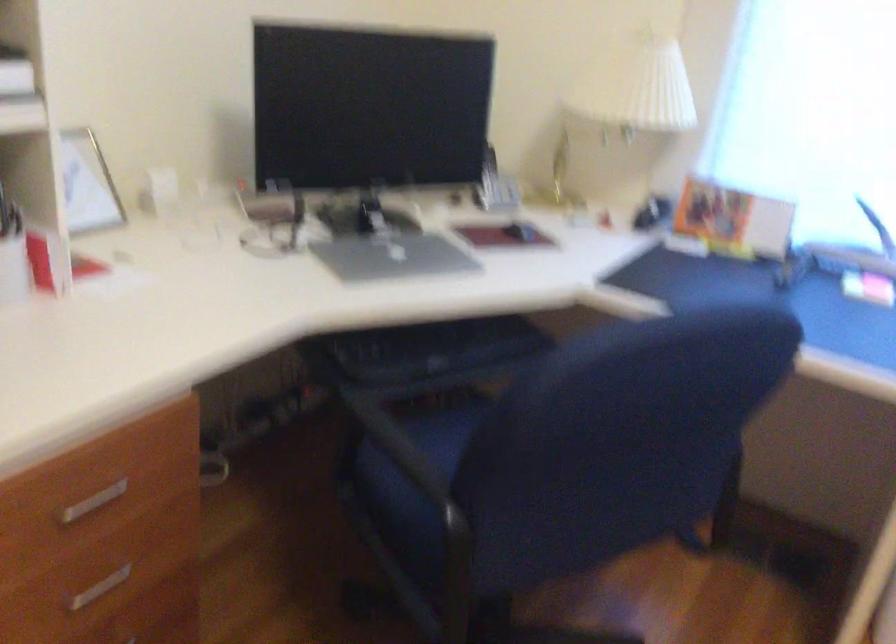
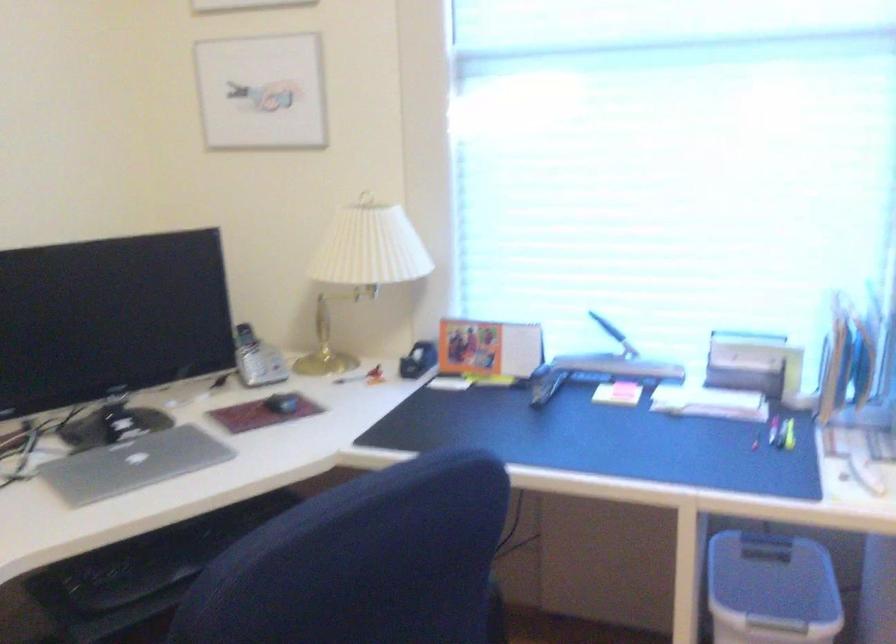
Question: The camera is either moving clockwise (left) or counter-clockwise (right) around the object. The first image is from the beginning of the video and the second image is from the end. Is the camera moving left or right when shooting the video?

Choices:
 (A) Left
 (B) Right

Answer: (A)